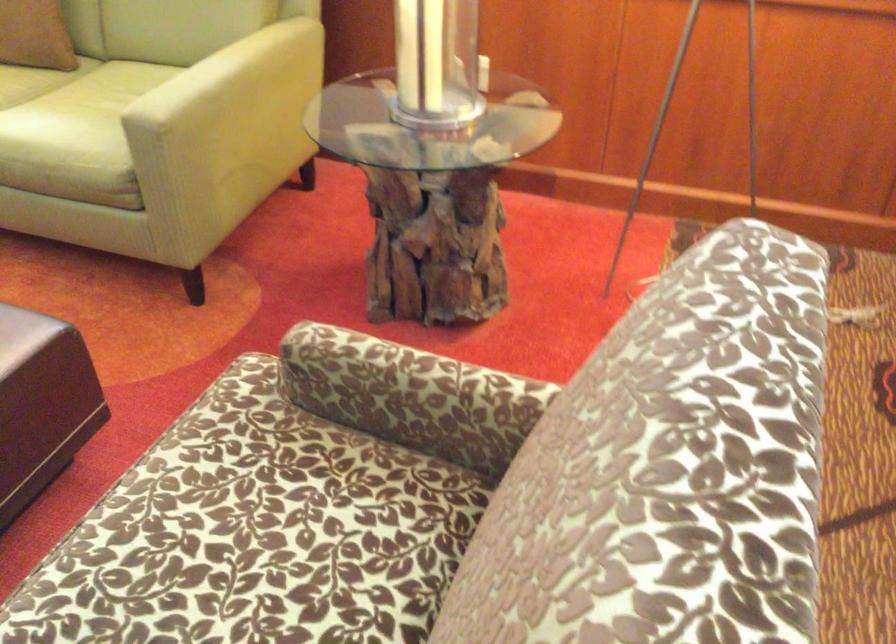
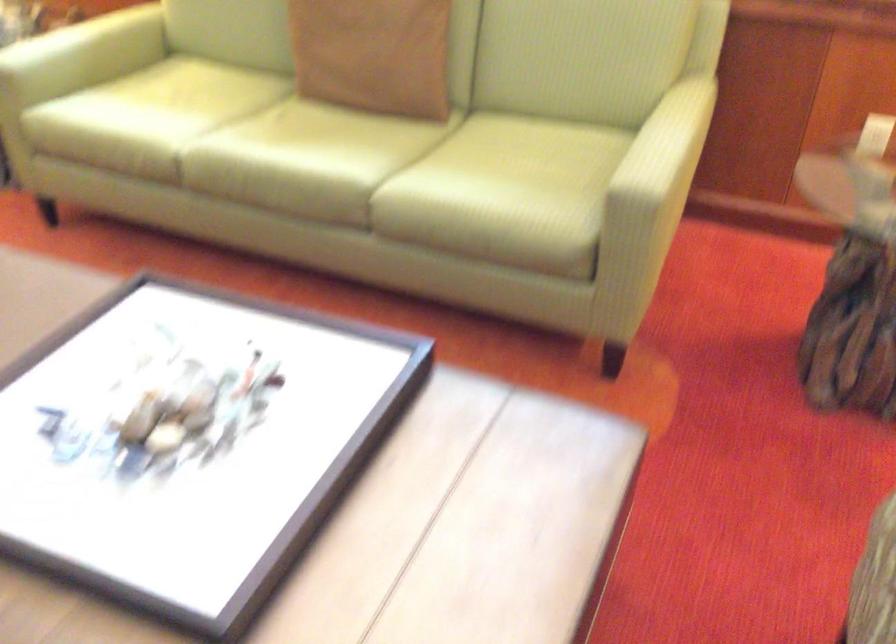
Question: I am providing you with two images of the same scene from different viewpoints. Please identify which objects are invisible in image2.

Choices:
 (A) sofa sitting surface
 (B) sofa armrest
 (C) brown pillow
 (D) none of these

Answer: (D)